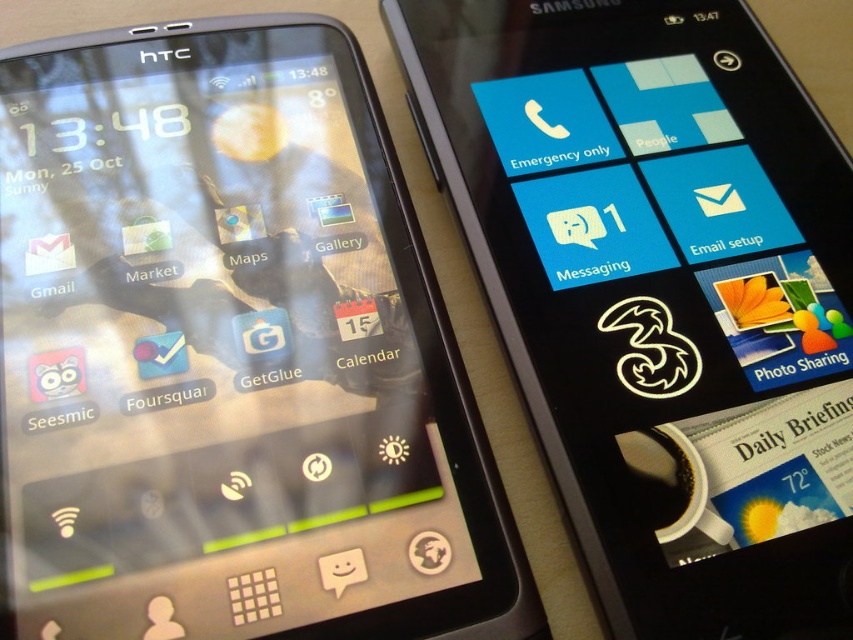
Does matte black phone at left appear under black glossy phone at upper left?

Yes, matte black phone at left is below black glossy phone at upper left.

Who is more forward, (142, 344) or (469, 214)?

Point (142, 344)

What are the coordinates of `matte black phone at left` in the screenshot? It's located at (230, 355).